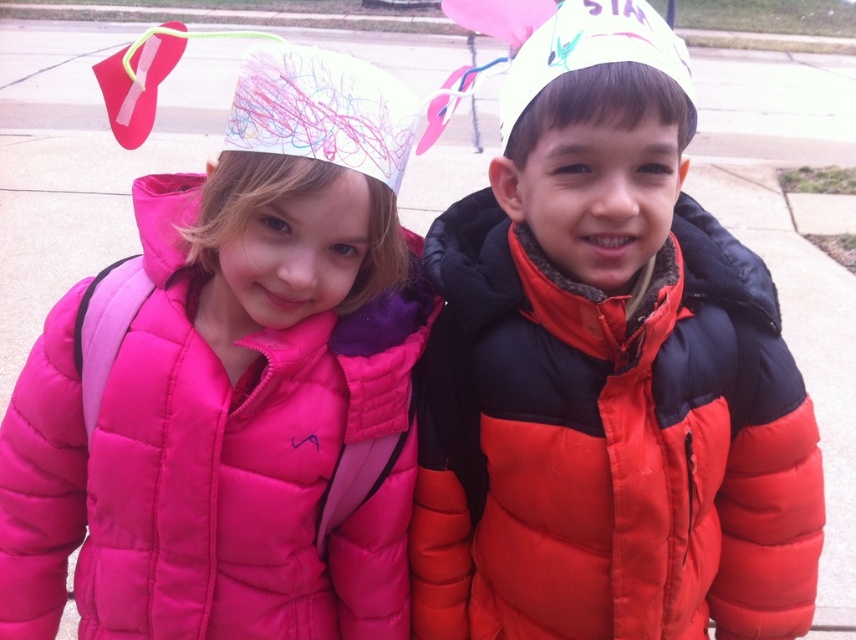
Question: Is matte black jacket at center positioned before matte pink puffer jacket at upper left?

Choices:
 (A) no
 (B) yes

Answer: (B)

Question: Which object is farther from the camera taking this photo?

Choices:
 (A) matte pink puffer jacket at upper left
 (B) matte black jacket at center

Answer: (A)

Question: Is matte black jacket at center to the right of matte pink puffer jacket at upper left from the viewer's perspective?

Choices:
 (A) yes
 (B) no

Answer: (A)

Question: Which point is farther to the camera?

Choices:
 (A) matte pink puffer jacket at upper left
 (B) matte black jacket at center

Answer: (A)

Question: Among these objects, which one is nearest to the camera?

Choices:
 (A) matte black jacket at center
 (B) matte pink puffer jacket at upper left

Answer: (A)

Question: Is matte black jacket at center closer to the viewer compared to matte pink puffer jacket at upper left?

Choices:
 (A) no
 (B) yes

Answer: (B)